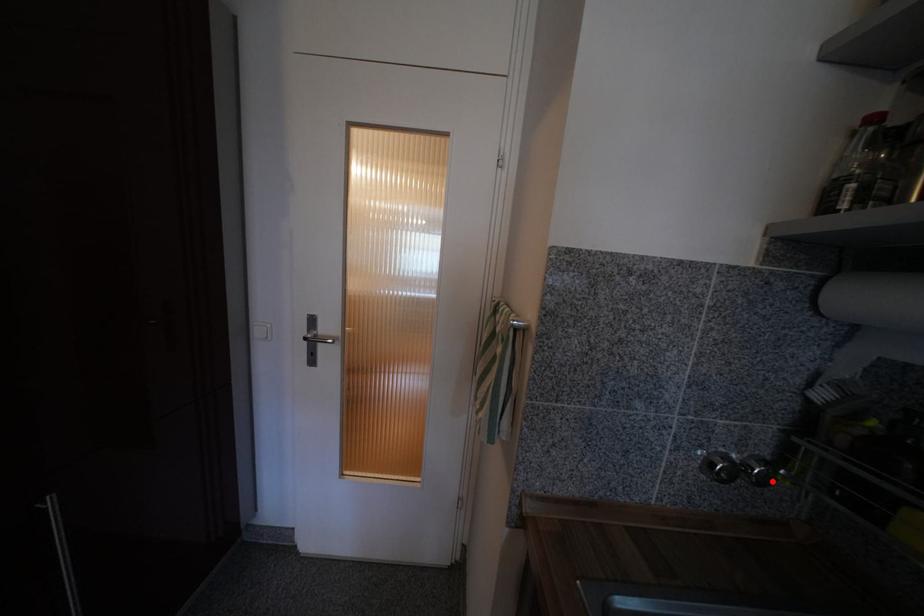
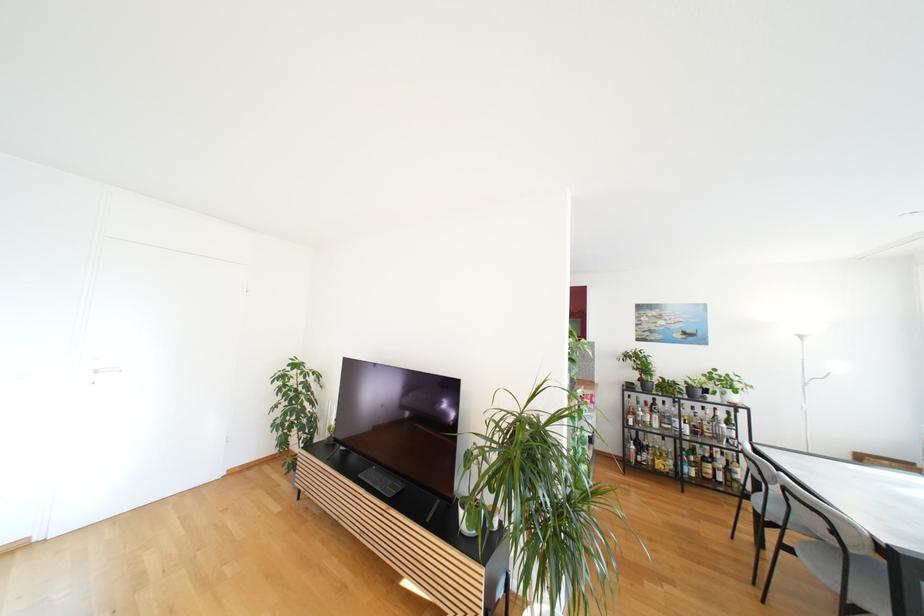
Question: I am providing you with two images of the same scene from different viewpoints. A red point is marked on the first image. Can you still see the location of the red point in image 2?

Choices:
 (A) Yes
 (B) No

Answer: (B)